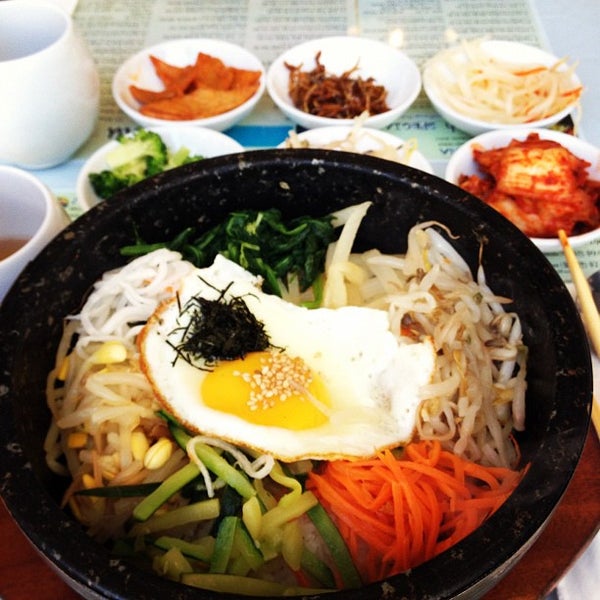
The height and width of the screenshot is (600, 600). Identify the location of background below table. (580, 587).